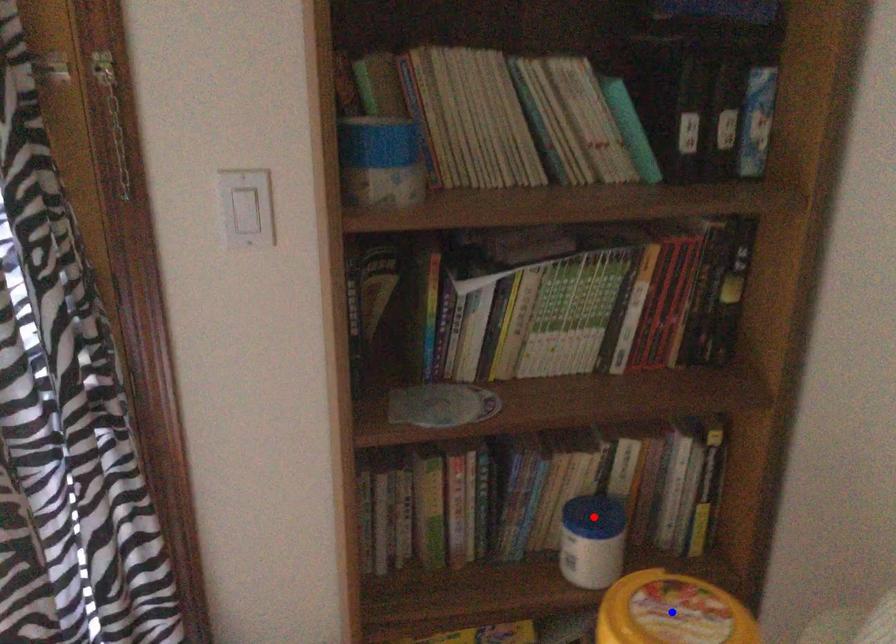
Question: Two points are marked on the image. Which point is closer to the camera?

Choices:
 (A) Blue point is closer.
 (B) Red point is closer.

Answer: (A)